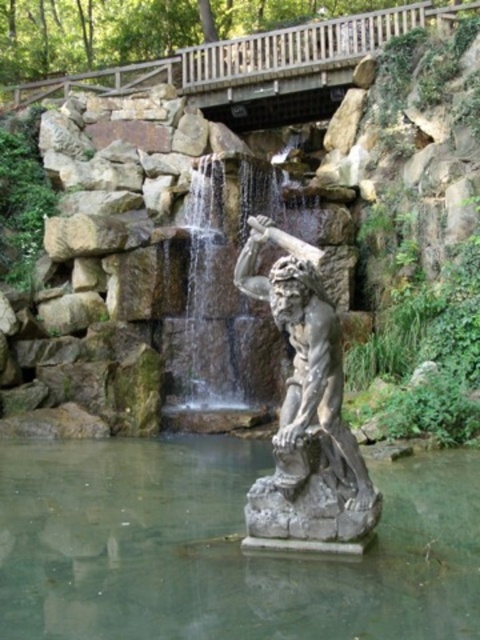
Question: Does clear stone water at center have a smaller size compared to wooden bridge at upper center?

Choices:
 (A) no
 (B) yes

Answer: (B)

Question: Is clear stone water at center positioned at the back of wooden bridge at upper center?

Choices:
 (A) yes
 (B) no

Answer: (B)

Question: Which point is closer to the camera taking this photo?

Choices:
 (A) (177, 400)
 (B) (240, 518)

Answer: (B)

Question: Estimate the real-world distances between objects in this image. Which object is farther from the wooden bridge at upper center?

Choices:
 (A) clear stone water at center
 (B) clear stone waterfall at center
 (C) stone statue at center

Answer: (A)

Question: Based on their relative distances, which object is nearer to the clear stone water at center?

Choices:
 (A) wooden bridge at upper center
 (B) clear stone waterfall at center
 (C) stone statue at center

Answer: (C)

Question: Can you confirm if clear stone water at center is positioned to the right of stone statue at center?

Choices:
 (A) yes
 (B) no

Answer: (B)